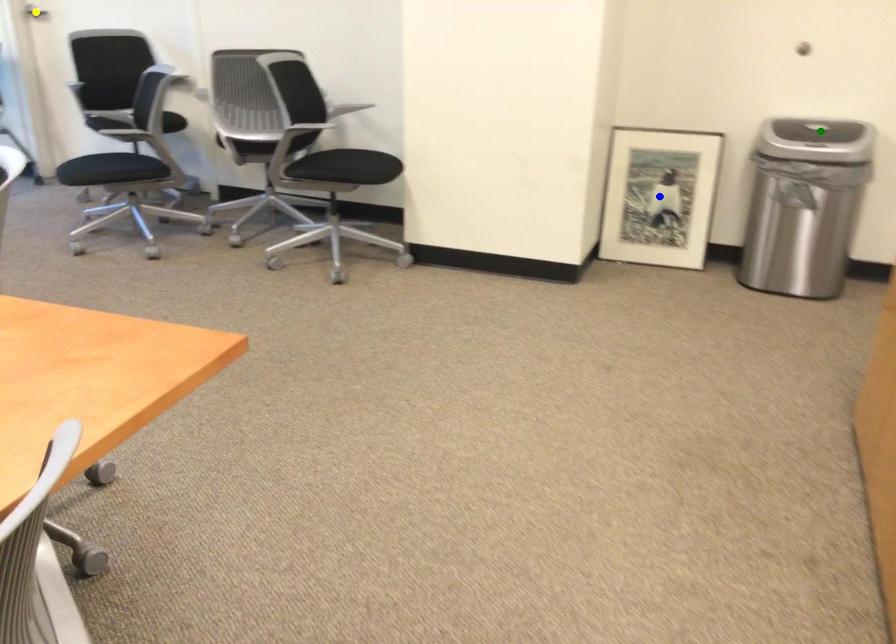
Order these from nearest to farthest:
- yellow point
- green point
- blue point

green point → blue point → yellow point